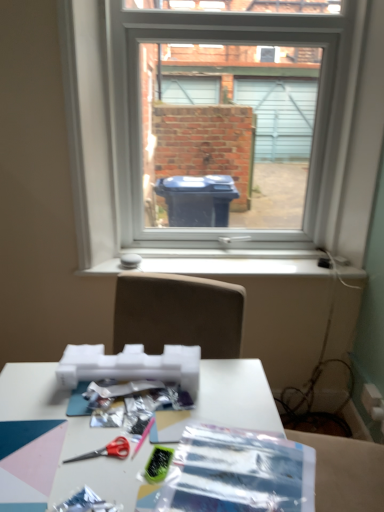
Question: From a real-world perspective, is red plastic scissors at lower center above or below white plastic window sill at center?

Choices:
 (A) below
 (B) above

Answer: (A)

Question: Is red plastic scissors at lower center bigger or smaller than white plastic window sill at center?

Choices:
 (A) small
 (B) big

Answer: (A)

Question: Estimate the real-world distances between objects in this image. Which object is farther from the white plastic window at center?

Choices:
 (A) white matte table at lower center
 (B) white plastic window sill at center
 (C) red plastic scissors at lower center
 (D) translucent plastic wrapping paper at center

Answer: (C)

Question: Based on their relative distances, which object is farther from the white matte table at lower center?

Choices:
 (A) white plastic window at center
 (B) translucent plastic wrapping paper at center
 (C) white plastic window sill at center
 (D) red plastic scissors at lower center

Answer: (A)